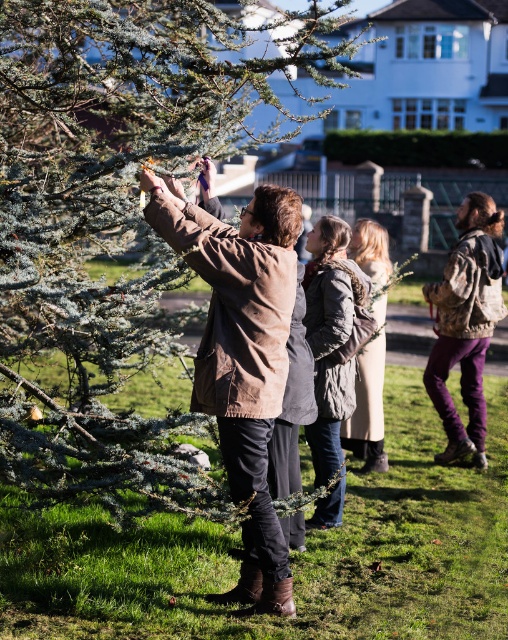
Is textured gray coat at center to the left of knitted gray sweater at center from the viewer's perspective?

Correct, you'll find textured gray coat at center to the left of knitted gray sweater at center.

Does textured gray coat at center have a lesser height compared to knitted gray sweater at center?

In fact, textured gray coat at center may be taller than knitted gray sweater at center.

Which is in front, point (321, 404) or point (355, 412)?

Point (321, 404) is more forward.

Where is `textured gray coat at center`? textured gray coat at center is located at coordinates (333, 337).

Is point (19, 177) farther from camera compared to point (368, 372)?

No, (19, 177) is in front of (368, 372).

Can you confirm if green textured pine tree at center is bigger than knitted gray sweater at center?

Incorrect, green textured pine tree at center is not larger than knitted gray sweater at center.

What are the coordinates of `green textured pine tree at center` in the screenshot? It's located at (111, 227).

Between green textured pine tree at center and textured gray coat at center, which one has more height?

With more height is textured gray coat at center.

Does point (76, 54) come behind point (335, 369)?

No.

Find the location of a particular element. The width and height of the screenshot is (508, 640). green textured pine tree at center is located at coordinates click(x=111, y=227).